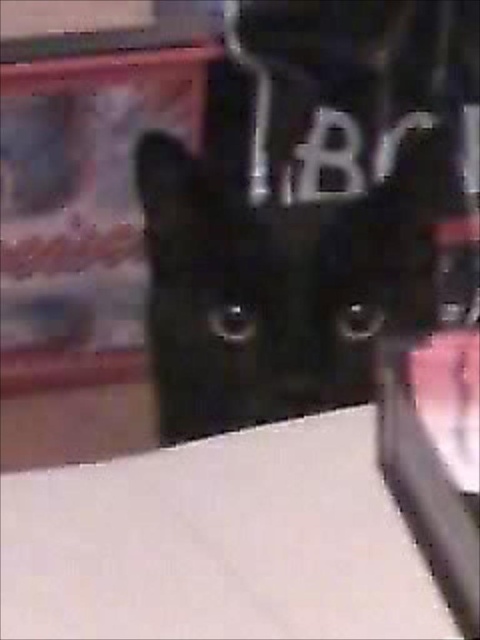
You are working in a workshop and need to place a tool that is 40 centimeters long on the white matte table at lower left without it overlapping the dark metallic component with BC letters. Is there enough space between them?

The distance between the white matte table at lower left and the dark metallic component with BC letters is 42.71 centimeters. Since the tool is 40 centimeters long, there is enough space to place it on the white matte table at lower left without overlapping.

You are an engineer inspecting a mechanical component. You notice the white matte table at lower left and the black glossy cat at center. Which object is nearer to you?

The white matte table at lower left is closer to the viewer than the black glossy cat at center.

You are an engineer inspecting a mechanical component labeled with the letters BC. You notice a white matte table at lower left and a black glossy cat at center. Which object is positioned to the left of the other?

The white matte table at lower left is to the left of the black glossy cat at center according to the description.